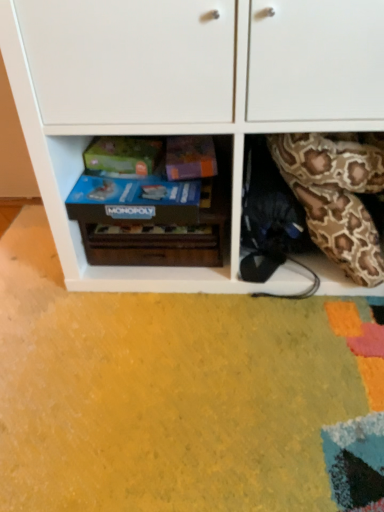
I want to click on blank space situated above blue cardboard monopoly game at center (from a real-world perspective), so click(x=131, y=181).